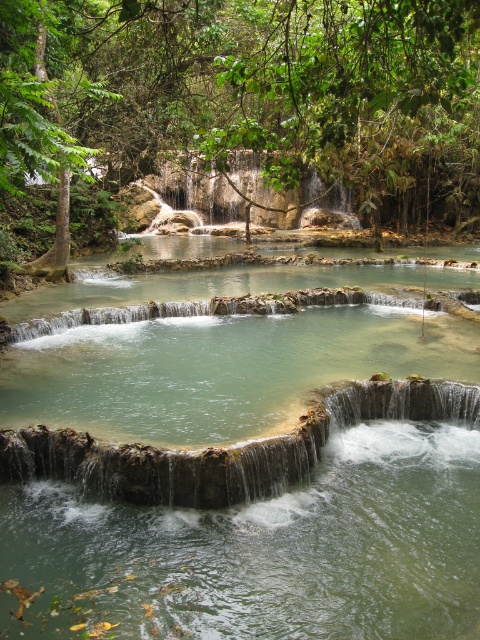
Which of these two, green stone waterfall at center or green leafy tree at upper center, stands taller?

green leafy tree at upper center is taller.

Which is behind, point (394, 624) or point (22, 8)?

The point (22, 8) is behind.

You are a GUI agent. You are given a task and a screenshot of the screen. Output one action in this format:
    pyautogui.click(x=<x>, y=<y>)
    Task: Click on the green stone waterfall at center
    The width and height of the screenshot is (480, 640).
    Given the screenshot: What is the action you would take?
    pyautogui.click(x=276, y=547)